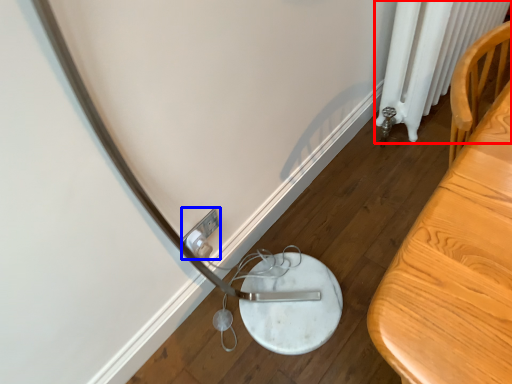
Question: Which object is further to the camera taking this photo, radiator (highlighted by a red box) or electric outlet (highlighted by a blue box)?

Choices:
 (A) radiator
 (B) electric outlet

Answer: (A)